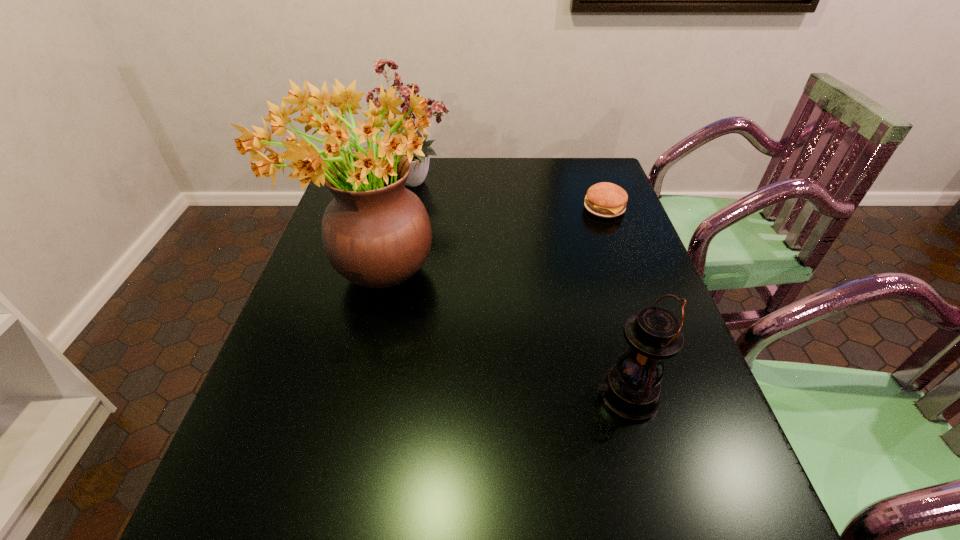
Find the location of a particular element. This screenshot has width=960, height=540. object that stands as the second closest to the third farthest object is located at coordinates (631, 389).

Where is `free spot that satisfies the following two spatial constraints: 1. on the front-facing side of the farthest object; 2. on the right side of the second farthest object`? free spot that satisfies the following two spatial constraints: 1. on the front-facing side of the farthest object; 2. on the right side of the second farthest object is located at coordinates (411, 208).

Where is `free space that satisfies the following two spatial constraints: 1. on the front-facing side of the shorter flower arrangement; 2. on the front side of the nearer flower arrangement`? free space that satisfies the following two spatial constraints: 1. on the front-facing side of the shorter flower arrangement; 2. on the front side of the nearer flower arrangement is located at coordinates (397, 276).

Locate an element on the screen. The height and width of the screenshot is (540, 960). blank area in the image that satisfies the following two spatial constraints: 1. on the front-facing side of the hamburger; 2. on the right side of the farther flower arrangement is located at coordinates (411, 208).

Image resolution: width=960 pixels, height=540 pixels. Identify the location of vacant area that satisfies the following two spatial constraints: 1. on the front-facing side of the third shortest object; 2. on the right side of the shortest object. (411, 208).

Locate an element on the screen. This screenshot has height=540, width=960. free space that satisfies the following two spatial constraints: 1. on the front-facing side of the hamburger; 2. on the left side of the farthest object is located at coordinates (411, 208).